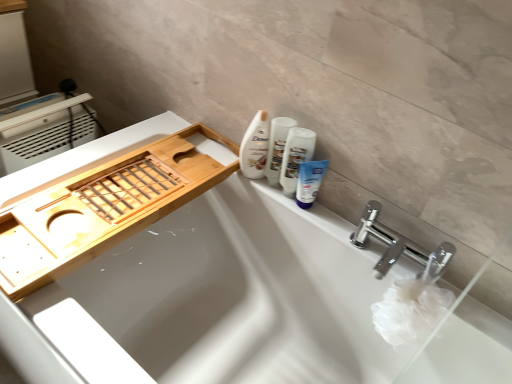
Question: Can you confirm if white glossy tube at upper right is taller than white glossy lotion at upper right, the 2th toiletry positioned from the right?

Choices:
 (A) yes
 (B) no

Answer: (B)

Question: Considering the relative sizes of white glossy tube at upper right and white glossy lotion at upper right, the 2th toiletry positioned from the right, in the image provided, is white glossy tube at upper right bigger than white glossy lotion at upper right, the 2th toiletry positioned from the right,?

Choices:
 (A) no
 (B) yes

Answer: (B)

Question: Can you confirm if white glossy tube at upper right is shorter than white glossy lotion at upper right, the 2th toiletry positioned from the right?

Choices:
 (A) yes
 (B) no

Answer: (A)

Question: From the image's perspective, is white glossy tube at upper right located beneath white glossy lotion at upper right, arranged as the first toiletry when viewed from the left?

Choices:
 (A) no
 (B) yes

Answer: (B)

Question: From a real-world perspective, does white glossy tube at upper right sit lower than white glossy lotion at upper right, the 2th toiletry positioned from the right?

Choices:
 (A) no
 (B) yes

Answer: (B)

Question: From the image's perspective, is white glossy lotion at upper right, the 2th toiletry positioned from the right, located above or below white glossy bathtub at upper center?

Choices:
 (A) below
 (B) above

Answer: (B)

Question: Is point (283, 127) positioned closer to the camera than point (266, 329)?

Choices:
 (A) farther
 (B) closer

Answer: (B)

Question: From a real-world perspective, is white glossy lotion at upper right, the 2th toiletry positioned from the right, positioned above or below white glossy bathtub at upper center?

Choices:
 (A) below
 (B) above

Answer: (B)

Question: Considering the positions of white glossy lotion at upper right, arranged as the first toiletry when viewed from the left, and white glossy bathtub at upper center in the image, is white glossy lotion at upper right, arranged as the first toiletry when viewed from the left, wider or thinner than white glossy bathtub at upper center?

Choices:
 (A) thin
 (B) wide

Answer: (A)

Question: Is point (x=186, y=360) closer or farther from the camera than point (x=272, y=155)?

Choices:
 (A) farther
 (B) closer

Answer: (A)

Question: Is white glossy bathtub at upper center to the left or to the right of white glossy lotion at upper right, the 2th toiletry positioned from the right, in the image?

Choices:
 (A) left
 (B) right

Answer: (A)

Question: Is white glossy bathtub at upper center situated inside white glossy lotion at upper right, the 2th toiletry positioned from the right, or outside?

Choices:
 (A) inside
 (B) outside

Answer: (B)

Question: From the image's perspective, is white glossy bathtub at upper center located above or below white glossy lotion at upper right, the 2th toiletry positioned from the right?

Choices:
 (A) below
 (B) above

Answer: (A)

Question: Relative to blue matte tube at upper right, the 1th toiletry positioned from the right, is white glossy lotion at upper right, arranged as the first toiletry when viewed from the left, in front or behind?

Choices:
 (A) behind
 (B) front

Answer: (A)

Question: Looking at their shapes, would you say white glossy lotion at upper right, the 2th toiletry positioned from the right, is wider or thinner than blue matte tube at upper right, the second toiletry in the left-to-right sequence?

Choices:
 (A) wide
 (B) thin

Answer: (A)